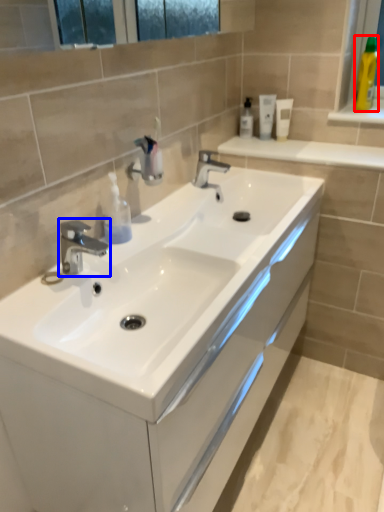
Question: Which object appears farthest to the camera in this image, toiletry (highlighted by a red box) or tap (highlighted by a blue box)?

Choices:
 (A) toiletry
 (B) tap

Answer: (A)